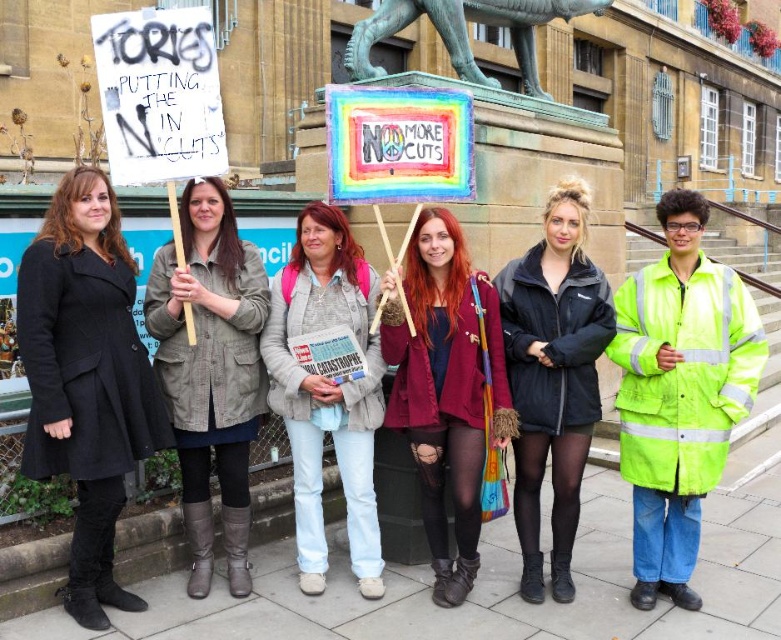
You are a photographer standing at the camera position. You want to take a closeup photo of the maroon satin blazer at center. However, there is a rule that you cannot move closer than 15 meters to the subject. Can you take the photo without violating the rule?

The maroon satin blazer at center is 14.93 meters from camera, which is less than 15 meters. Therefore, moving closer would violate the rule. To comply, you must stay at least 15 meters away, meaning you cannot take a closeup without moving closer.